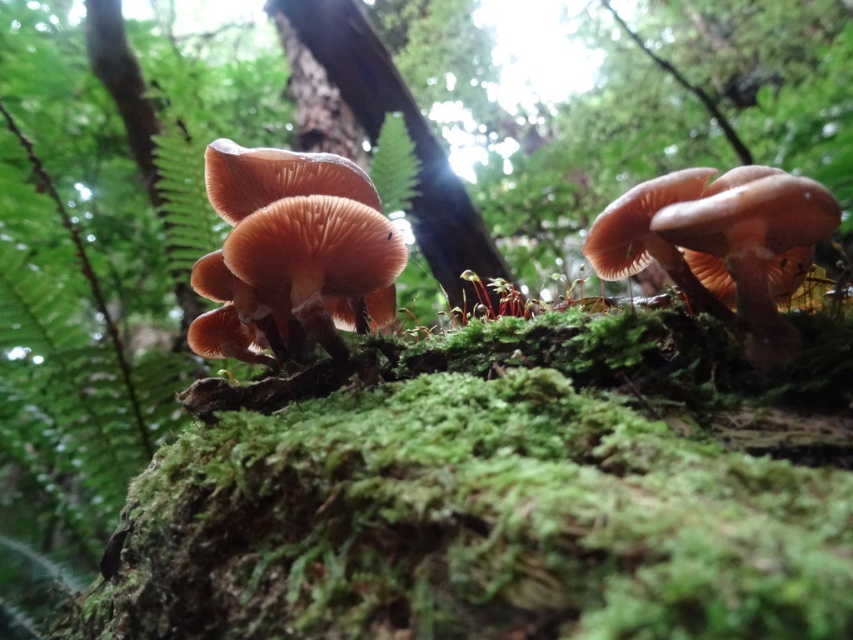
Question: Among these objects, which one is nearest to the camera?

Choices:
 (A) smooth brown tree trunk at center
 (B) brown matte fungi at center

Answer: (B)

Question: Is brown matte fungi at center behind smooth brown tree trunk at center?

Choices:
 (A) no
 (B) yes

Answer: (A)

Question: Among these points, which one is nearest to the camera?

Choices:
 (A) (445, 156)
 (B) (316, 260)

Answer: (B)

Question: Is brown matte fungi at center further to the viewer compared to smooth brown tree trunk at center?

Choices:
 (A) no
 (B) yes

Answer: (A)

Question: Is brown matte fungi at center thinner than smooth brown tree trunk at center?

Choices:
 (A) no
 (B) yes

Answer: (B)

Question: Which point is closer to the camera?

Choices:
 (A) (296, 257)
 (B) (467, 260)

Answer: (A)